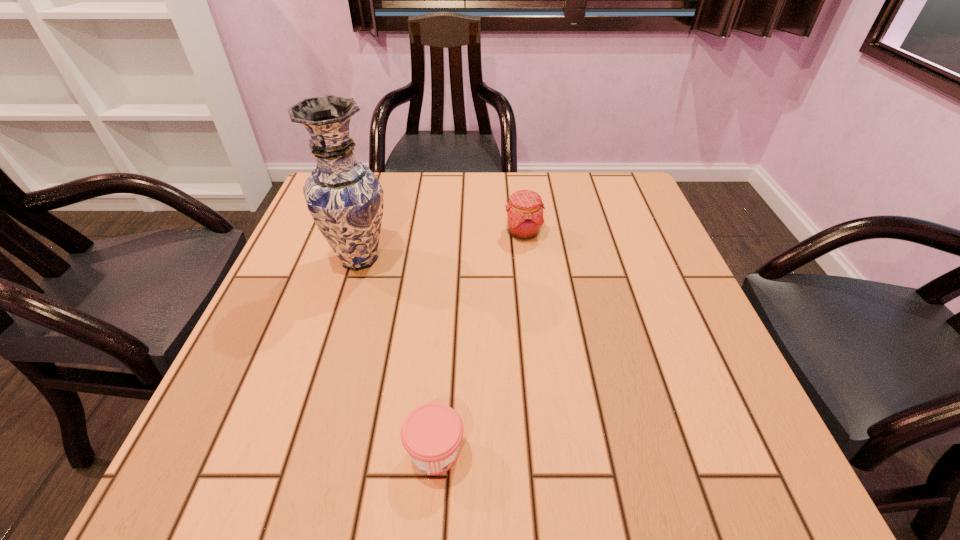
Locate an element on the screen. Image resolution: width=960 pixels, height=540 pixels. the tallest object is located at coordinates (344, 197).

Find the location of `the leftmost object`. the leftmost object is located at coordinates (344, 197).

At what (x,y) coordinates should I click in order to perform the action: click on the farther jam. Please return your answer as a coordinate pair (x, y). The image size is (960, 540). Looking at the image, I should click on (524, 218).

Locate an element on the screen. the taller jam is located at coordinates (524, 218).

You are a GUI agent. You are given a task and a screenshot of the screen. Output one action in this format:
    pyautogui.click(x=<x>, y=<y>)
    Task: Click on the second object from left to right
    Image resolution: width=960 pixels, height=540 pixels.
    Given the screenshot: What is the action you would take?
    pyautogui.click(x=431, y=434)

You are a GUI agent. You are given a task and a screenshot of the screen. Output one action in this format:
    pyautogui.click(x=<x>, y=<y>)
    Task: Click on the shortest object
    This screenshot has height=540, width=960.
    Given the screenshot: What is the action you would take?
    pyautogui.click(x=431, y=434)

Where is `vacant area located 0.240m on the right of the tallest object`? The width and height of the screenshot is (960, 540). vacant area located 0.240m on the right of the tallest object is located at coordinates (502, 259).

Where is `free location located on the front of the second shortest object`? free location located on the front of the second shortest object is located at coordinates (531, 298).

You are a GUI agent. You are given a task and a screenshot of the screen. Output one action in this format:
    pyautogui.click(x=<x>, y=<y>)
    Task: Click on the blank space located on the front label of the nearer jam
    The width and height of the screenshot is (960, 540).
    Given the screenshot: What is the action you would take?
    pyautogui.click(x=585, y=452)

Image resolution: width=960 pixels, height=540 pixels. In order to click on object that is at the far edge in this screenshot , I will do `click(524, 218)`.